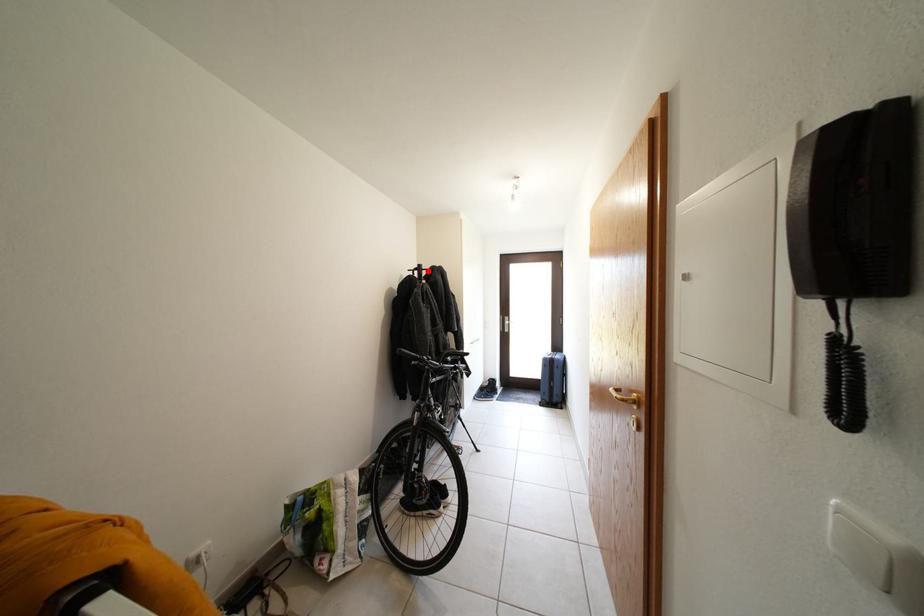
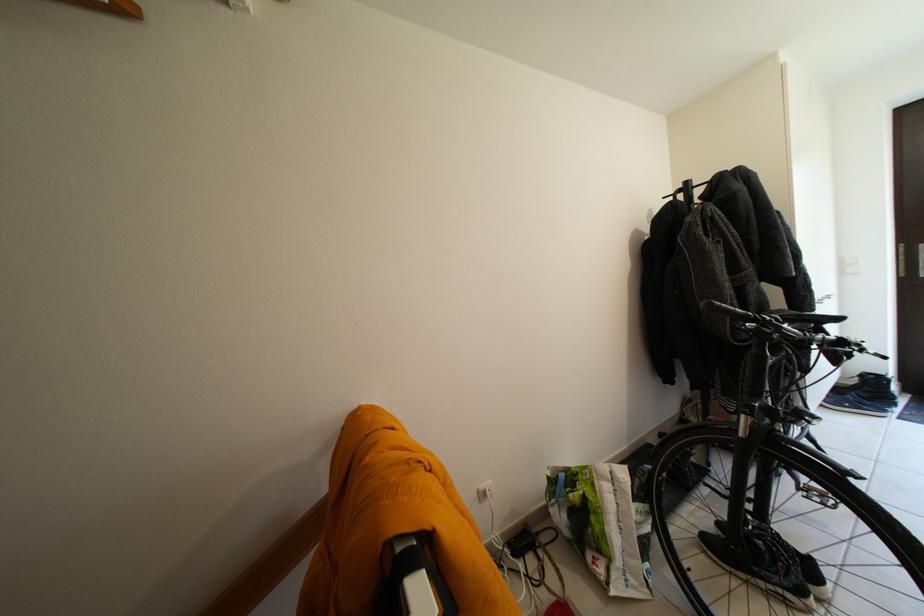
In the second image, find the point that corresponds to the highlighted location in the first image.

(696, 188)